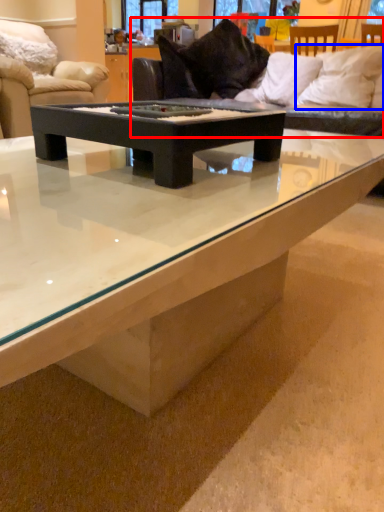
Question: Which of the following is the closest to the observer, studio couch (highlighted by a red box) or pillow (highlighted by a blue box)?

Choices:
 (A) studio couch
 (B) pillow

Answer: (A)